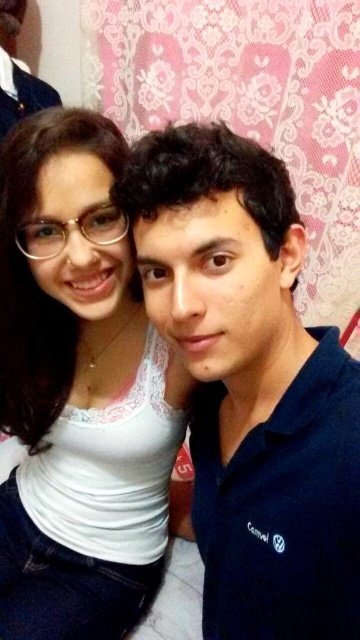
You are a photographer setting up a photo shoot with two models wearing the blue cotton polo shirt at center and the white lace top at upper left. You need to adjust the lighting so that the taller clothing item is well lit. Which clothing item should you focus the light on?

The white lace top at upper left is taller than the blue cotton polo shirt at center, so you should focus the light on the white lace top at upper left.

You are a photographer adjusting the lighting for a portrait session. You notice the white lace top at upper left and the matte black shirt at upper left in your frame. Which piece of clothing should you focus the light on to ensure proper exposure, considering their positions?

The white lace top at upper left is positioned on the right side of matte black shirt at upper left. Since white reflects more light than black, you should focus the light on the matte black shirt at upper left to balance exposure between both garments.

You are a photographer adjusting the focus on your camera. You want to ensure that the blue cotton polo shirt at center is in sharp focus. Based on the given information, what is the minimum focusing distance you should set your camera to?

The minimum focusing distance should be set to at least 18.02 inches to ensure the blue cotton polo shirt at center is in sharp focus.